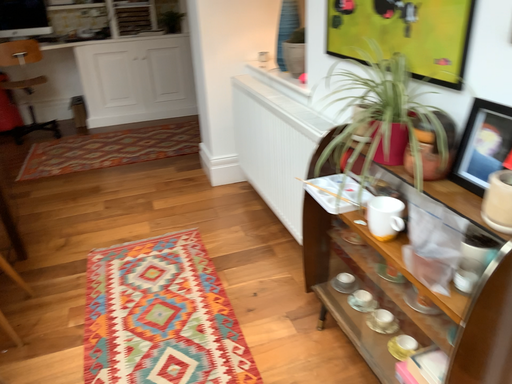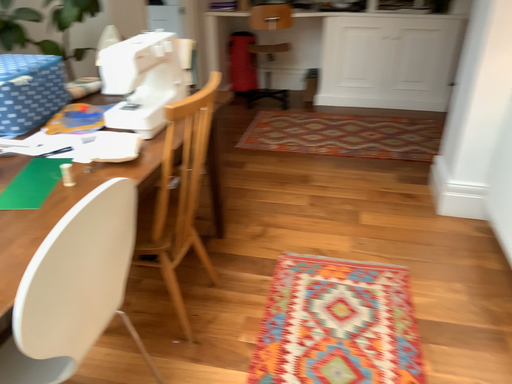
Question: Which way did the camera rotate in the video?

Choices:
 (A) rotated left
 (B) rotated right

Answer: (A)